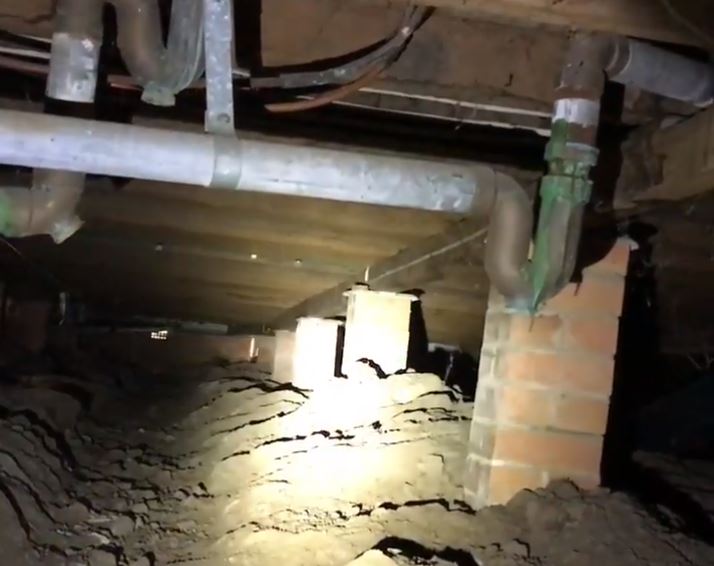
At what (x,y) coordinates should I click in order to perform the action: click on space right of support pillars. Please return your answer as a coordinate pair (x, y). Image resolution: width=714 pixels, height=566 pixels. Looking at the image, I should click on (683, 421).